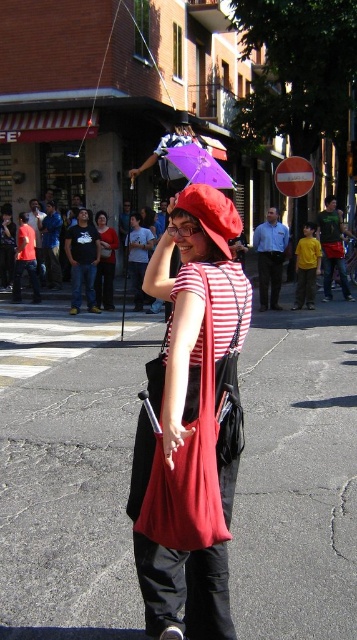
You are a photographer trying to capture a clear shot of the matte red bag at center and the purple glossy umbrella at center. Since both are in the same position, which one will appear taller in the photo?

The matte red bag at center appears taller than the purple glossy umbrella at center in the photo.

You are at the lively street scene and want to locate the matte red bag at center and the matte black shirt at center. Based on their positions, which one is on the left side?

The matte black shirt at center is on the left side because the matte red bag at center is to the right of it.

You are a photographer trying to capture a clear shot of the matte black shirt at center without the matte red bag at center blocking it. Based on the scene, is this possible?

The matte red bag at center is in front of the matte black shirt at center, so it is blocking the view. To capture the matte black shirt at center clearly, you need to move around to a position where the matte red bag at center is no longer in front.